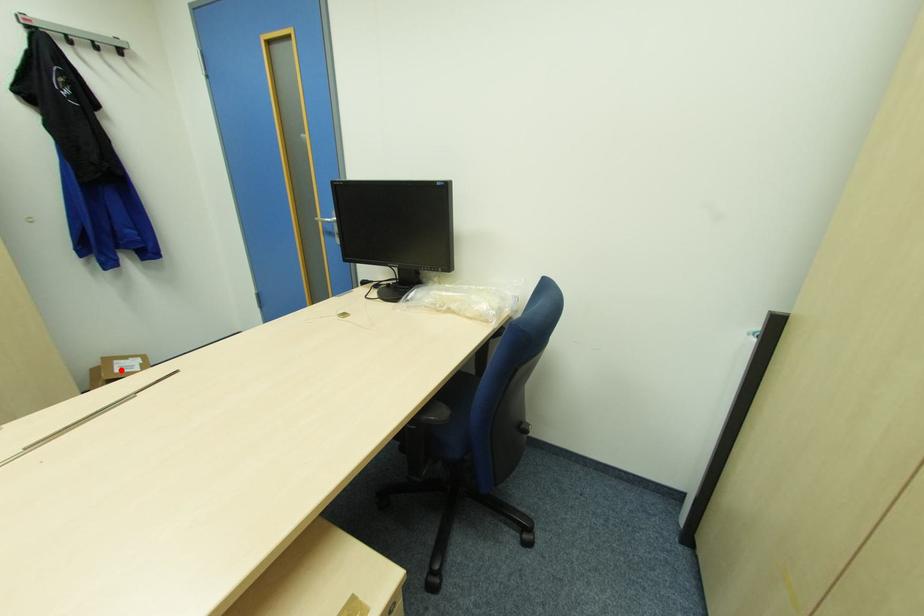
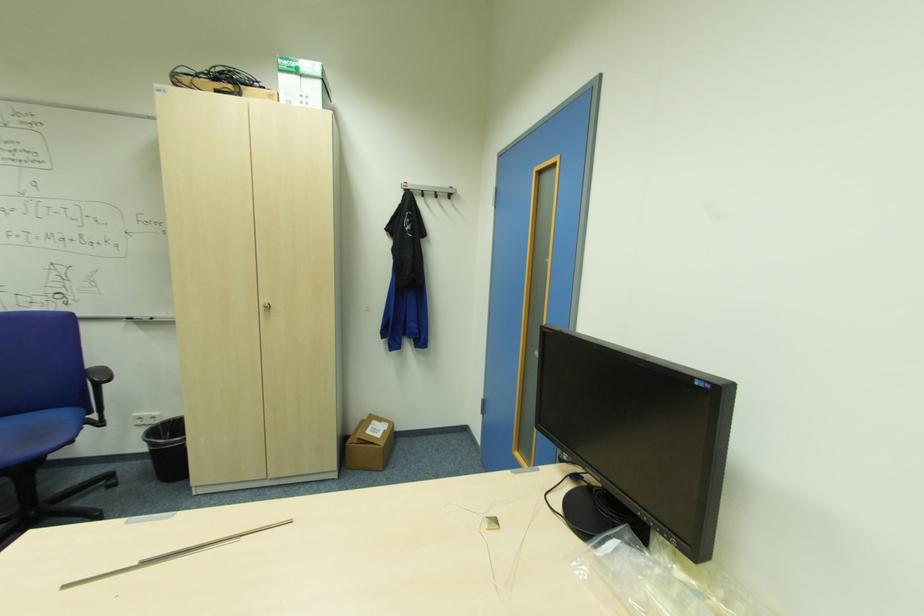
Find the pixel in the second image that matches the highlighted location in the first image.

(371, 431)